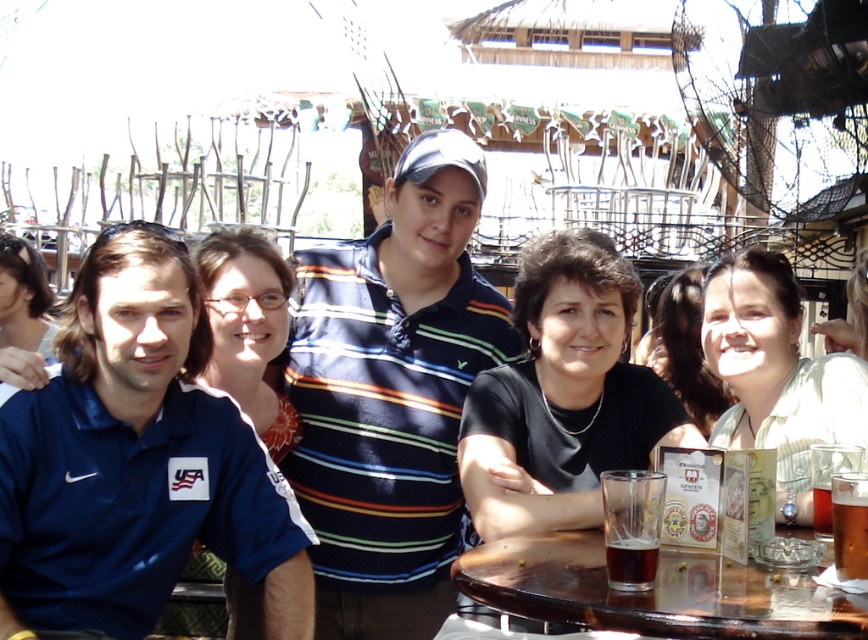
Image resolution: width=868 pixels, height=640 pixels. Describe the element at coordinates (684, 346) in the screenshot. I see `light beige blouse at center` at that location.

Who is shorter, light beige blouse at center or brown glass at table right?

brown glass at table right

Locate an element on the screen. light beige blouse at center is located at coordinates (684, 346).

Does light green shirt at center have a lesser width compared to brown glass at table right?

Incorrect, light green shirt at center's width is not less than brown glass at table right's.

Is light green shirt at center positioned in front of brown glass at table right?

No, it is behind brown glass at table right.

Is point (748, 365) farther from viewer compared to point (843, 480)?

Yes, it is.

Find the location of `light green shirt at center`. light green shirt at center is located at coordinates (778, 371).

Measure the distance from striped cotton shirt at center to black matte shirt at center.

The distance of striped cotton shirt at center from black matte shirt at center is 17.76 feet.

Is striped cotton shirt at center positioned behind black matte shirt at center?

That is False.

Identify the location of striped cotton shirt at center. (391, 394).

I want to click on striped cotton shirt at center, so click(391, 394).